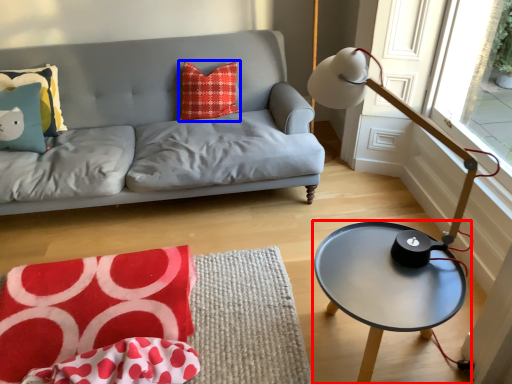
Question: Which point is further to the camera, coffee table (highlighted by a red box) or pillow (highlighted by a blue box)?

Choices:
 (A) coffee table
 (B) pillow

Answer: (B)